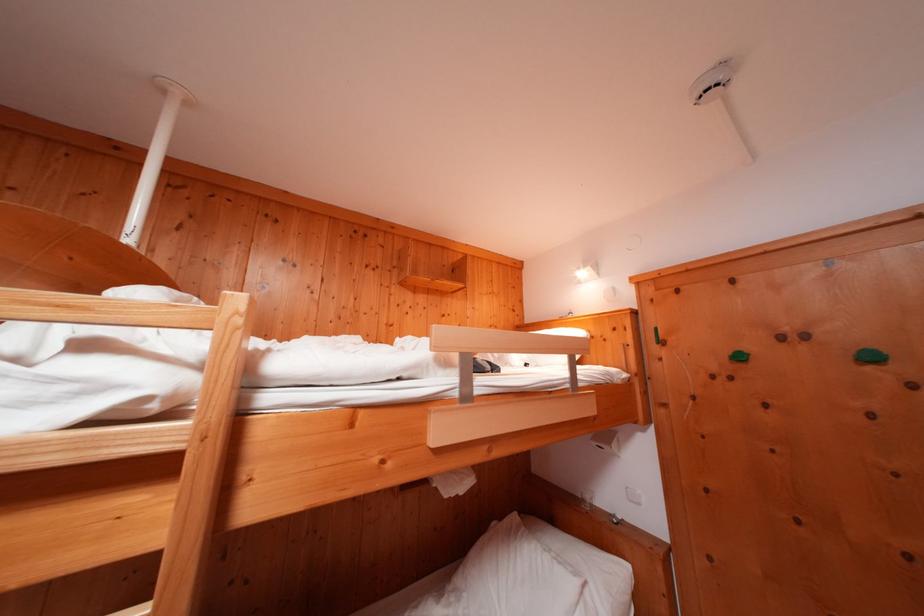
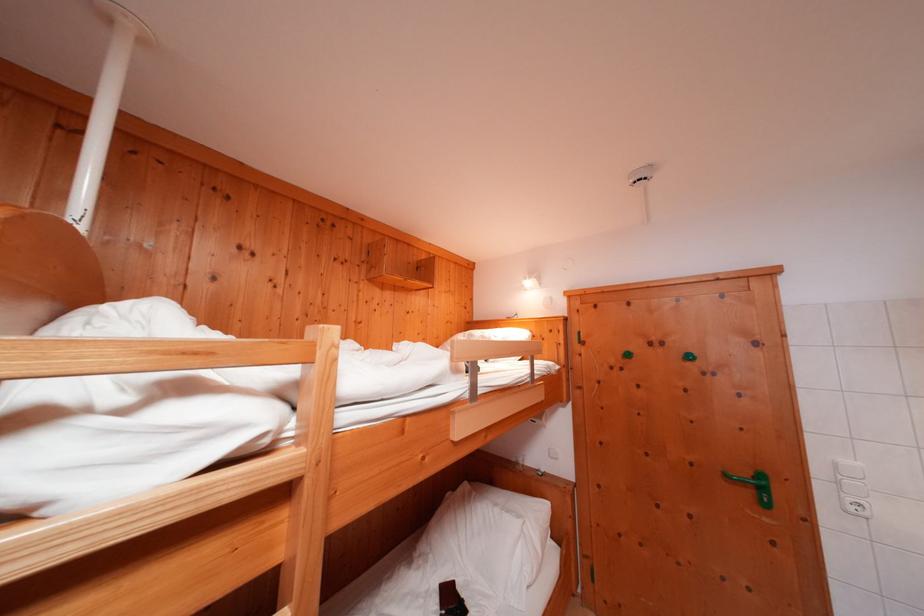
Question: What movement of the cameraman would produce the second image?

Choices:
 (A) Left
 (B) Right
 (C) Forward
 (D) Backward

Answer: (A)